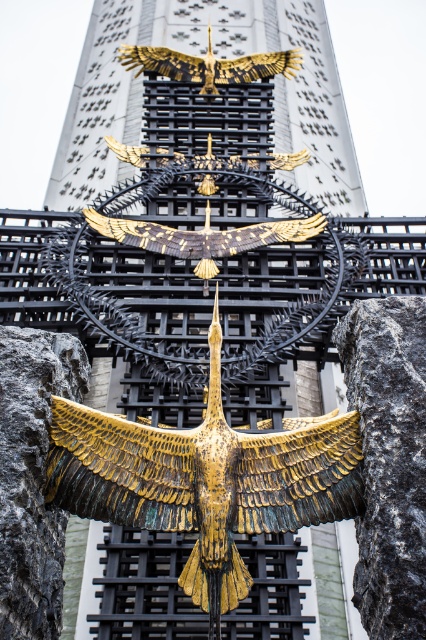
Question: Which object appears farthest from the camera in this image?

Choices:
 (A) gold metallic eagle at upper center
 (B) gold matte eagle at center
 (C) gold-bronze bird at center

Answer: (A)

Question: Among these points, which one is farthest from the camera?

Choices:
 (A) (103, 220)
 (B) (57, 400)
 (C) (146, 68)

Answer: (C)

Question: Can you confirm if gold matte eagle at center is positioned below gold metallic eagle at upper center?

Choices:
 (A) no
 (B) yes

Answer: (B)

Question: Considering the real-world distances, which object is farthest from the gold matte eagle at center?

Choices:
 (A) gold-bronze bird at center
 (B) gold metallic eagle at upper center

Answer: (B)

Question: Is gold-bronze bird at center to the left of gold matte eagle at center from the viewer's perspective?

Choices:
 (A) no
 (B) yes

Answer: (A)

Question: In this image, where is gold matte eagle at center located relative to gold metallic eagle at upper center?

Choices:
 (A) above
 (B) below

Answer: (B)